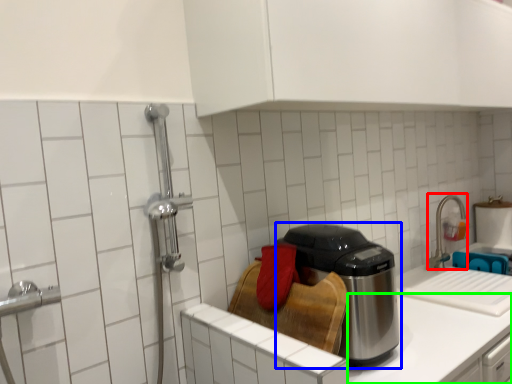
Question: Based on their relative distances, which object is farther from faucet (highlighted by a red box)? Choose from kitchen appliance (highlighted by a blue box) and counter top (highlighted by a green box).

Choices:
 (A) kitchen appliance
 (B) counter top

Answer: (A)